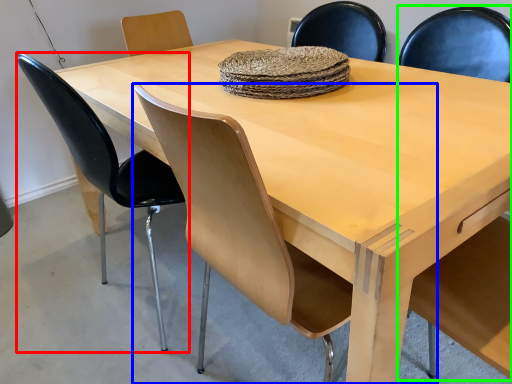
Question: Which is farther away from chair (highlighted by a red box)? chair (highlighted by a blue box) or armchair (highlighted by a green box)?

Choices:
 (A) chair
 (B) armchair

Answer: (B)